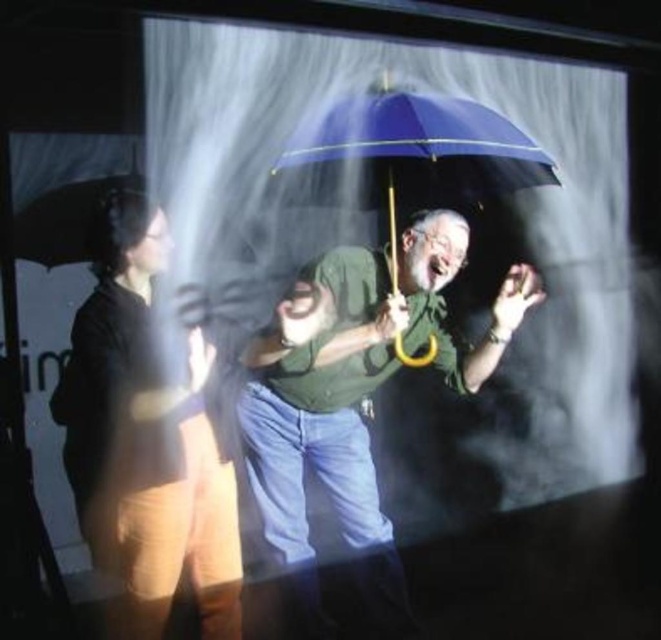
Question: Does matte green shirt at center appear under matte black jacket at left?

Choices:
 (A) yes
 (B) no

Answer: (A)

Question: Does matte green shirt at center have a greater width compared to matte black jacket at left?

Choices:
 (A) no
 (B) yes

Answer: (B)

Question: Which point is farther to the camera?

Choices:
 (A) matte green shirt at center
 (B) blue matte umbrella at center
 (C) matte black jacket at left

Answer: (C)

Question: Which point is farther from the camera taking this photo?

Choices:
 (A) 529,179
 (B) 196,440
 (C) 321,625

Answer: (C)

Question: Does matte green shirt at center appear on the right side of matte black jacket at left?

Choices:
 (A) no
 (B) yes

Answer: (B)

Question: Estimate the real-world distances between objects in this image. Which object is closer to the matte black jacket at left?

Choices:
 (A) blue matte umbrella at center
 (B) matte green shirt at center

Answer: (B)